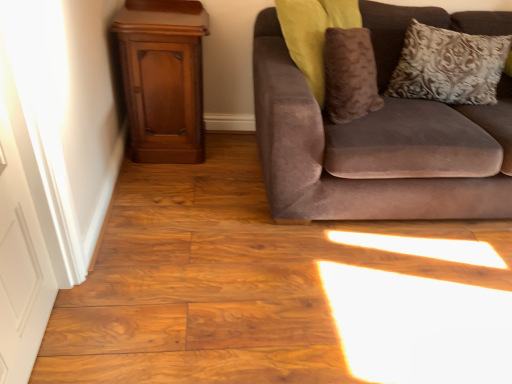
Where is `free area in between suede couch at right and white painted wood door at left`? free area in between suede couch at right and white painted wood door at left is located at coordinates (237, 265).